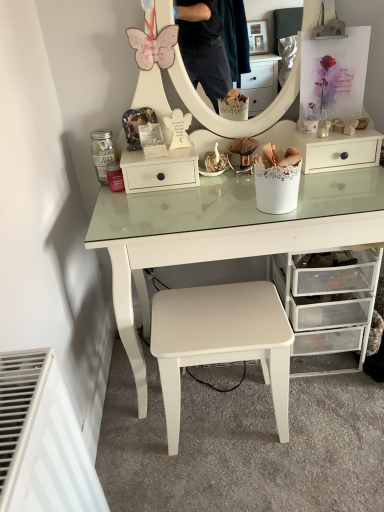
Question: Is white matte drawer at center inside or outside of clear plastic drawers at lower right?

Choices:
 (A) outside
 (B) inside

Answer: (A)

Question: From a real-world perspective, is white matte drawer at center positioned above or below clear plastic drawers at lower right?

Choices:
 (A) below
 (B) above

Answer: (B)

Question: Estimate the real-world distances between objects in this image. Which object is closer to the white matte stool at center?

Choices:
 (A) white matte drawer at center
 (B) clear plastic drawers at lower right

Answer: (B)

Question: Estimate the real-world distances between objects in this image. Which object is farther from the white matte stool at center?

Choices:
 (A) clear plastic drawers at lower right
 (B) white matte drawer at center

Answer: (B)